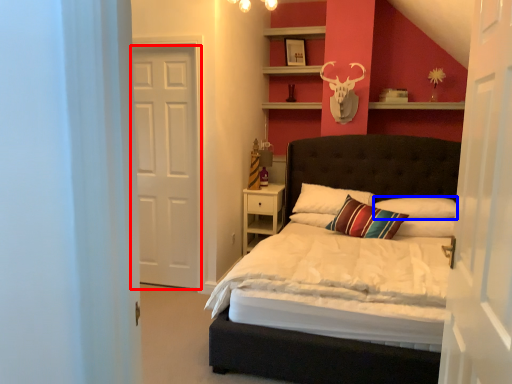
Question: Among these objects, which one is farthest to the camera, door (highlighted by a red box) or pillow (highlighted by a blue box)?

Choices:
 (A) door
 (B) pillow

Answer: (B)